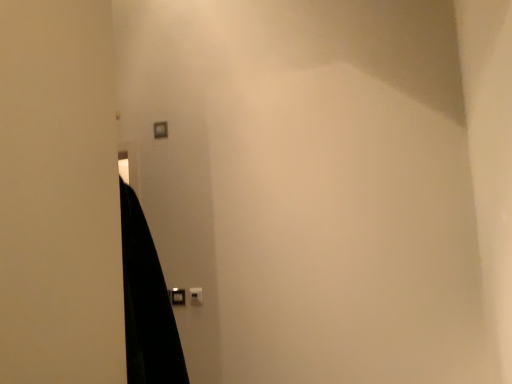
This screenshot has height=384, width=512. In order to click on matte plastic light switch at upper center, arranged as the second light switch when ordered from the bottom in this screenshot , I will do coord(160,129).

What is the approximate width of white plastic light switch at center, which appears as the first light switch when ordered from the bottom?

white plastic light switch at center, which appears as the first light switch when ordered from the bottom, is 1.02 inches in width.

Describe the element at coordinates (177, 296) in the screenshot. Image resolution: width=512 pixels, height=384 pixels. I see `black plastic door handle at lower center` at that location.

This screenshot has width=512, height=384. I want to click on matte plastic light switch at upper center, arranged as the first light switch when viewed from the back, so click(160, 129).

Measure the distance between white plastic light switch at center, arranged as the 1th light switch when viewed from the front, and matte plastic light switch at upper center, arranged as the second light switch when ordered from the bottom.

The distance of white plastic light switch at center, arranged as the 1th light switch when viewed from the front, from matte plastic light switch at upper center, arranged as the second light switch when ordered from the bottom, is 36.51 inches.

Is white plastic light switch at center, which appears as the 2th light switch when viewed from the top, oriented away from matte plastic light switch at upper center, acting as the 2th light switch starting from the front?

That's not correct — white plastic light switch at center, which appears as the 2th light switch when viewed from the top, is not looking away from matte plastic light switch at upper center, acting as the 2th light switch starting from the front.

Considering the sizes of objects white plastic light switch at center, which appears as the 2th light switch when viewed from the top, and matte plastic light switch at upper center, arranged as the first light switch when viewed from the back, in the image provided, who is taller, white plastic light switch at center, which appears as the 2th light switch when viewed from the top, or matte plastic light switch at upper center, arranged as the first light switch when viewed from the back,?

With more height is matte plastic light switch at upper center, arranged as the first light switch when viewed from the back.

Looking at this image, which is closer to the camera, (194,296) or (155,137)?

Point (194,296) is closer to the camera than point (155,137).

Are black plastic door handle at lower center and matte plastic light switch at upper center, acting as the 2th light switch starting from the front, far apart?

black plastic door handle at lower center is near matte plastic light switch at upper center, acting as the 2th light switch starting from the front, not far away.

Which is closer to the camera, (174, 300) or (156, 137)?

Clearly, point (174, 300) is closer to the camera than point (156, 137).

Between black plastic door handle at lower center and matte plastic light switch at upper center, placed as the first light switch when sorted from left to right, which one has larger width?

black plastic door handle at lower center.

Is black plastic door handle at lower center at the left side of matte plastic light switch at upper center, placed as the first light switch when sorted from left to right?

No.

Is point (193, 290) closer or farther from the camera than point (170, 290)?

Point (193, 290) appears to be closer to the viewer than point (170, 290).

Considering the relative sizes of white plastic light switch at center, which is the 1th light switch from right to left, and black plastic door handle at lower center in the image provided, is white plastic light switch at center, which is the 1th light switch from right to left, smaller than black plastic door handle at lower center?

Yes.

From the picture: Considering the positions of objects white plastic light switch at center, arranged as the second light switch when viewed from the back, and black plastic door handle at lower center in the image provided, who is more to the left, white plastic light switch at center, arranged as the second light switch when viewed from the back, or black plastic door handle at lower center?

black plastic door handle at lower center.

Would you say white plastic light switch at center, arranged as the second light switch when viewed from the back, is inside or outside black plastic door handle at lower center?

white plastic light switch at center, arranged as the second light switch when viewed from the back, is not inside black plastic door handle at lower center, it's outside.

Is matte plastic light switch at upper center, placed as the first light switch when sorted from left to right, next to white plastic light switch at center, arranged as the 1th light switch when viewed from the front?

They are not placed beside each other.

The image size is (512, 384). I want to click on light switch located below the matte plastic light switch at upper center, marked as the first light switch in a top-to-bottom arrangement (from the image's perspective), so click(196, 296).

Is matte plastic light switch at upper center, acting as the 2th light switch starting from the front, positioned beyond the bounds of white plastic light switch at center, arranged as the 1th light switch when viewed from the front?

Indeed, matte plastic light switch at upper center, acting as the 2th light switch starting from the front, is completely outside white plastic light switch at center, arranged as the 1th light switch when viewed from the front.

Can you tell me how much matte plastic light switch at upper center, placed as the first light switch when sorted from left to right, and black plastic door handle at lower center differ in facing direction?

The facing directions of matte plastic light switch at upper center, placed as the first light switch when sorted from left to right, and black plastic door handle at lower center are 0.0308 degrees apart.

Is black plastic door handle at lower center a part of matte plastic light switch at upper center, acting as the 2th light switch starting from the right?

That's incorrect, black plastic door handle at lower center is not inside matte plastic light switch at upper center, acting as the 2th light switch starting from the right.

Considering the relative positions of matte plastic light switch at upper center, arranged as the first light switch when viewed from the back, and black plastic door handle at lower center in the image provided, is matte plastic light switch at upper center, arranged as the first light switch when viewed from the back, to the right of black plastic door handle at lower center from the viewer's perspective?

In fact, matte plastic light switch at upper center, arranged as the first light switch when viewed from the back, is to the left of black plastic door handle at lower center.

Is matte plastic light switch at upper center, acting as the 2th light switch starting from the front, positioned behind black plastic door handle at lower center?

Yes, matte plastic light switch at upper center, acting as the 2th light switch starting from the front, is further from the camera.

Looking at this image, considering the positions of objects black plastic door handle at lower center and white plastic light switch at center, arranged as the second light switch when viewed from the back, in the image provided, who is more to the right, black plastic door handle at lower center or white plastic light switch at center, arranged as the second light switch when viewed from the back,?

white plastic light switch at center, arranged as the second light switch when viewed from the back, is more to the right.

Looking at this image, can you see black plastic door handle at lower center touching white plastic light switch at center, arranged as the 1th light switch when viewed from the front?

Yes, black plastic door handle at lower center and white plastic light switch at center, arranged as the 1th light switch when viewed from the front, clearly make contact.

Can you confirm if black plastic door handle at lower center is shorter than white plastic light switch at center, arranged as the second light switch when viewed from the back?

Correct, black plastic door handle at lower center is not as tall as white plastic light switch at center, arranged as the second light switch when viewed from the back.

Locate an element on the screen. This screenshot has height=384, width=512. door handle on the left of the white plastic light switch at center, arranged as the second light switch when viewed from the back is located at coordinates (177, 296).

Where is `light switch below the matte plastic light switch at upper center, placed as the first light switch when sorted from left to right (from a real-world perspective)`? The image size is (512, 384). light switch below the matte plastic light switch at upper center, placed as the first light switch when sorted from left to right (from a real-world perspective) is located at coordinates (196, 296).

This screenshot has height=384, width=512. What are the coordinates of `the 2nd light switch above the black plastic door handle at lower center (from the image's perspective)` in the screenshot? It's located at (160, 129).

Consider the image. Estimate the real-world distances between objects in this image. Which object is closer to matte plastic light switch at upper center, arranged as the second light switch when ordered from the bottom, black plastic door handle at lower center or white plastic light switch at center, which appears as the first light switch when ordered from the bottom?

The object closer to matte plastic light switch at upper center, arranged as the second light switch when ordered from the bottom, is black plastic door handle at lower center.

From the image, which object appears to be farther from black plastic door handle at lower center, matte plastic light switch at upper center, acting as the 2th light switch starting from the right, or white plastic light switch at center, which appears as the first light switch when ordered from the bottom?

matte plastic light switch at upper center, acting as the 2th light switch starting from the right, lies further to black plastic door handle at lower center than the other object.

Looking at the image, which one is located closer to white plastic light switch at center, arranged as the second light switch when viewed from the back, black plastic door handle at lower center or matte plastic light switch at upper center, acting as the 2th light switch starting from the right?

Among the two, black plastic door handle at lower center is located nearer to white plastic light switch at center, arranged as the second light switch when viewed from the back.

When comparing their distances from matte plastic light switch at upper center, placed as the first light switch when sorted from left to right, does white plastic light switch at center, arranged as the second light switch when viewed from the back, or black plastic door handle at lower center seem further?

The object further to matte plastic light switch at upper center, placed as the first light switch when sorted from left to right, is white plastic light switch at center, arranged as the second light switch when viewed from the back.

From the picture: Which object lies nearer to the anchor point white plastic light switch at center, which is the 1th light switch from right to left, matte plastic light switch at upper center, acting as the 2th light switch starting from the right, or black plastic door handle at lower center?

black plastic door handle at lower center.

Which object lies further to the anchor point black plastic door handle at lower center, white plastic light switch at center, arranged as the 1th light switch when viewed from the front, or matte plastic light switch at upper center, acting as the 2th light switch starting from the front?

matte plastic light switch at upper center, acting as the 2th light switch starting from the front, lies further to black plastic door handle at lower center than the other object.

At what (x,y) coordinates should I click in order to perform the action: click on light switch between matte plastic light switch at upper center, arranged as the second light switch when ordered from the bottom, and black plastic door handle at lower center from top to bottom. Please return your answer as a coordinate pair (x, y). This screenshot has width=512, height=384. Looking at the image, I should click on (196, 296).